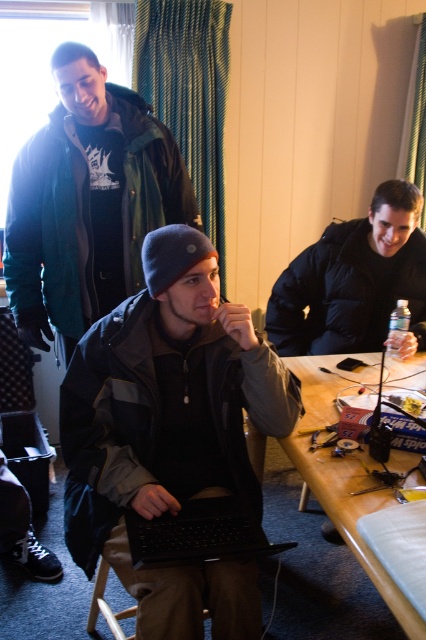
Is point (389, 605) less distant than point (138, 532)?

Yes.

Find the location of a particular element. wooden table at center is located at coordinates (344, 476).

Is matte black laptop at center wider than black puffy jacket at upper right?

Correct, the width of matte black laptop at center exceeds that of black puffy jacket at upper right.

Between point (233, 436) and point (385, 250), which one is positioned behind?

Positioned behind is point (385, 250).

This screenshot has width=426, height=640. In order to click on matte black laptop at center in this screenshot , I will do `click(170, 433)`.

Does matte black jacket at upper left appear under black puffy jacket at upper right?

Incorrect, matte black jacket at upper left is not positioned below black puffy jacket at upper right.

Is point (51, 205) closer to viewer compared to point (394, 189)?

That is False.

Identify the location of matte black jacket at upper left. (88, 202).